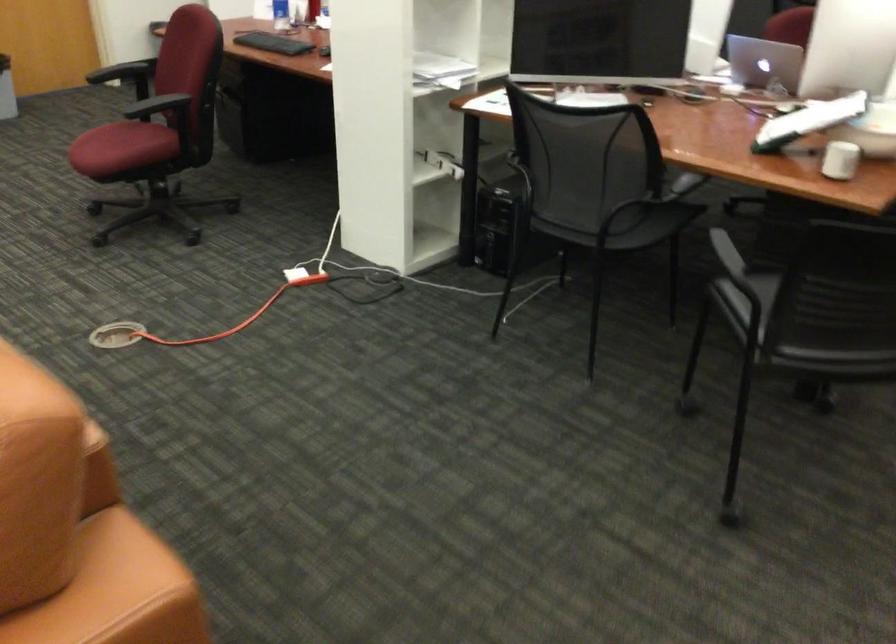
Identify the location of black computer keyboard. [x=273, y=43].